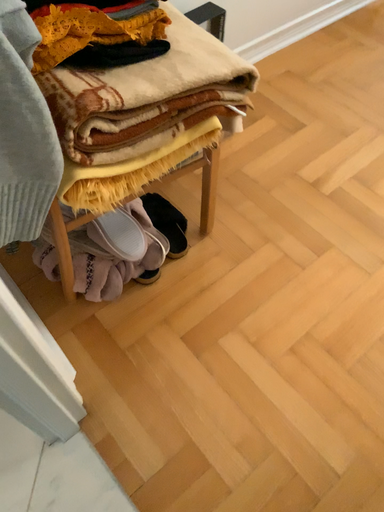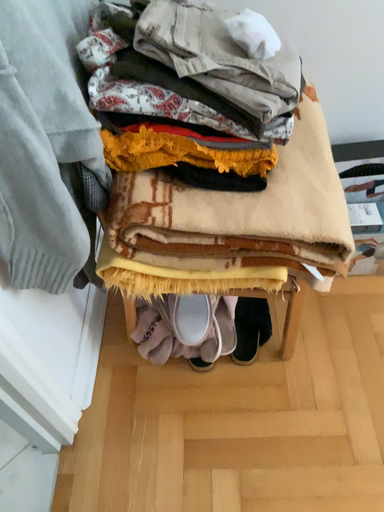
Question: Which way did the camera rotate in the video?

Choices:
 (A) rotated right
 (B) rotated left

Answer: (B)